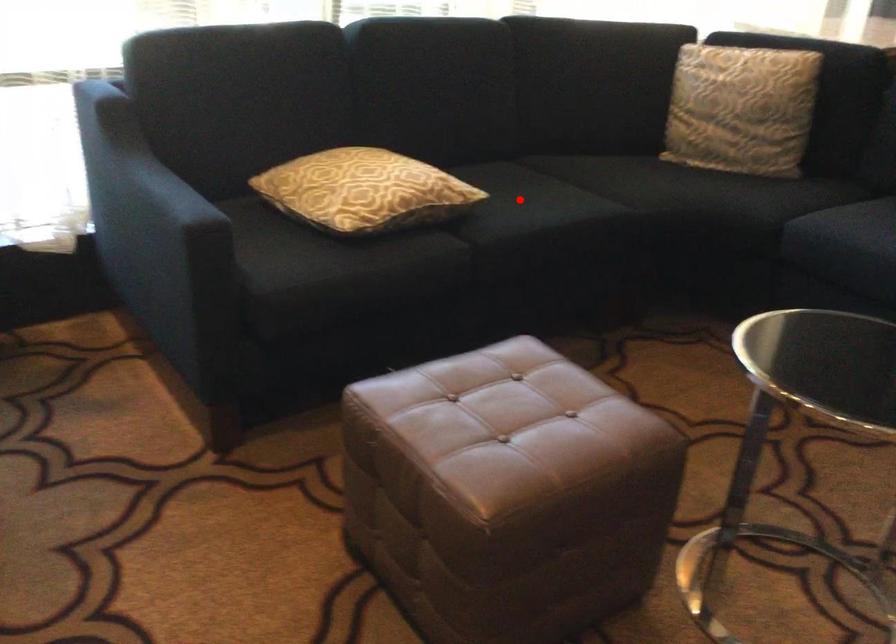
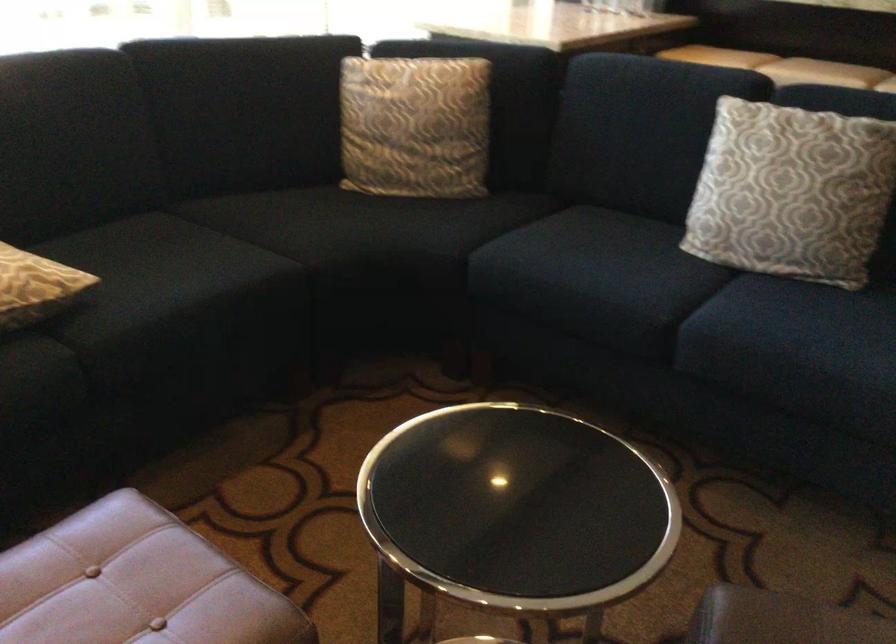
Question: I am providing you with two images of the same scene from different viewpoints. A red point is shown in image1. For the corresponding object point in image2, is it positioned nearer or farther from the camera?

Choices:
 (A) Nearer
 (B) Farther

Answer: (A)